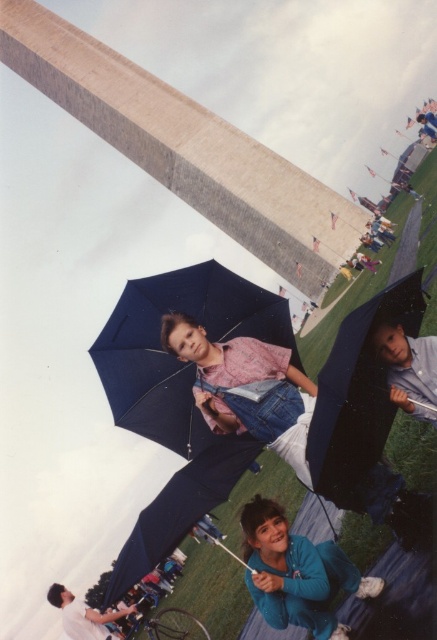
Can you confirm if matte blue umbrella at center is positioned above matte blue umbrella at lower right?

Actually, matte blue umbrella at center is below matte blue umbrella at lower right.

Between point (197, 285) and point (332, 410), which one is positioned behind?

Point (197, 285)

Where is `matte blue umbrella at center`? This screenshot has height=640, width=437. matte blue umbrella at center is located at coordinates (179, 397).

Is matte blue umbrella at center to the right of blue fleece jacket at lower center from the viewer's perspective?

In fact, matte blue umbrella at center is to the left of blue fleece jacket at lower center.

Does matte blue umbrella at center lie behind blue fleece jacket at lower center?

That is True.

Image resolution: width=437 pixels, height=640 pixels. What do you see at coordinates (179, 397) in the screenshot?
I see `matte blue umbrella at center` at bounding box center [179, 397].

Image resolution: width=437 pixels, height=640 pixels. I want to click on matte blue umbrella at center, so click(179, 397).

Is matte blue umbrella at lower right to the left of blue fleece jacket at lower center from the viewer's perspective?

Incorrect, matte blue umbrella at lower right is not on the left side of blue fleece jacket at lower center.

Can you confirm if matte blue umbrella at lower right is positioned above blue fleece jacket at lower center?

Yes.

Does point (337, 342) come farther from viewer compared to point (280, 568)?

No, (337, 342) is in front of (280, 568).

Locate an element on the screen. The image size is (437, 640). matte blue umbrella at lower right is located at coordinates (357, 394).